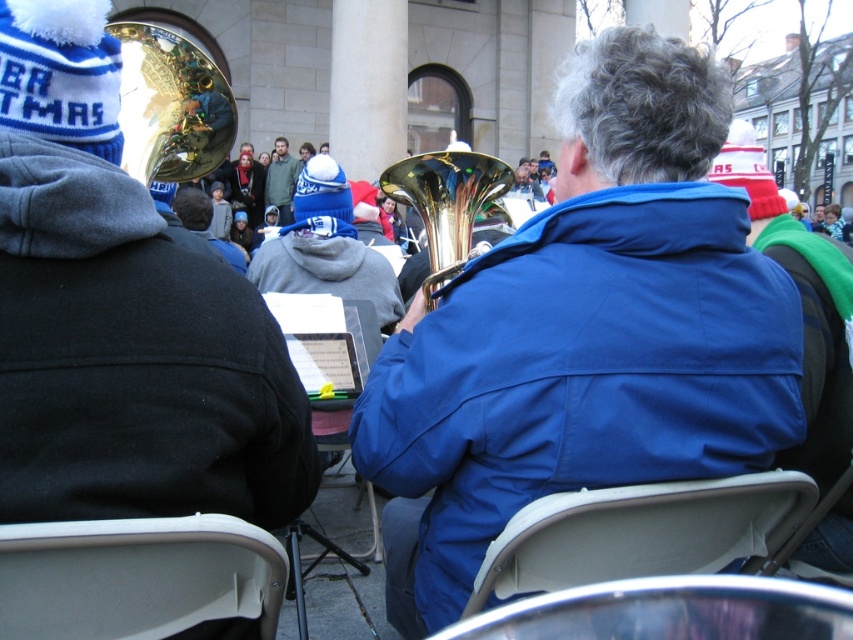
You are organizing a small winter concert and need to seat two guests. You have a white plastic chair at lower left and a metallic silver chair at lower center. Which chair should you choose if you want to accommodate a taller guest?

The white plastic chair at lower left is larger in size than the metallic silver chair at lower center, so it can better accommodate a taller guest.